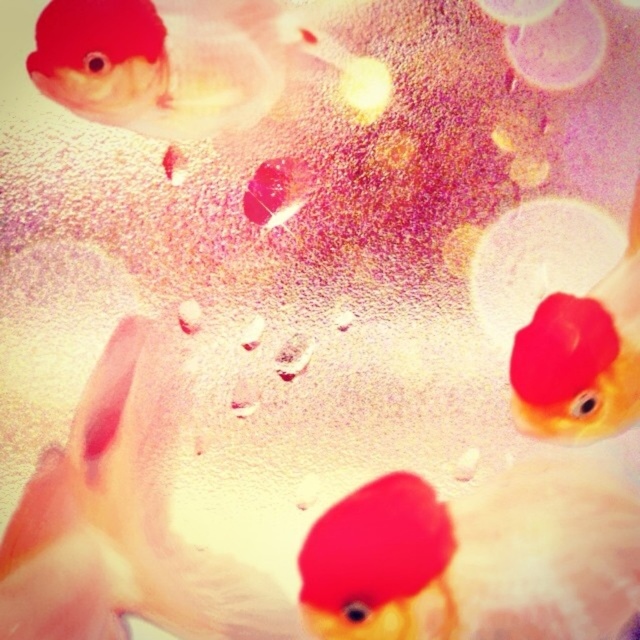
You are an aquarium caretaker and need to identify the position of the goldfish. Which goldfish is located to the left of the other? The options are the matte red goldfish at upper right and the matte goldfish at upper right.

The matte red goldfish at upper right is positioned on the left side of the matte goldfish at upper right.

You are an aquarium caretaker trying to feed the fish. You have a small food pellet that you want to drop into the tank. Which goldfish will the pellet reach first if it sinks straight down from the top of the tank? The options are the matte red goldfish at upper right and the matte goldfish at upper right.

The pellet will reach the matte red goldfish at upper right first because it is located below the matte goldfish at upper right, so it is closer to the sinking pellet.